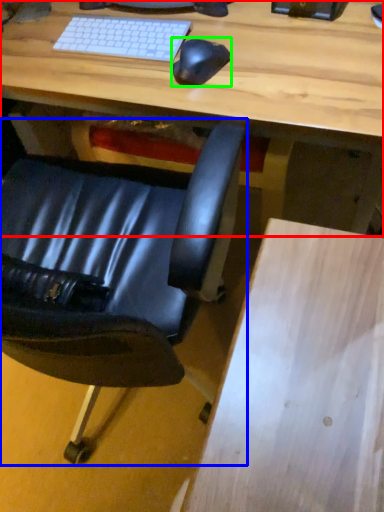
Question: Estimate the real-world distances between objects in this image. Which object is farther from desk (highlighted by a red box), chair (highlighted by a blue box) or mouse (highlighted by a green box)?

Choices:
 (A) chair
 (B) mouse

Answer: (A)